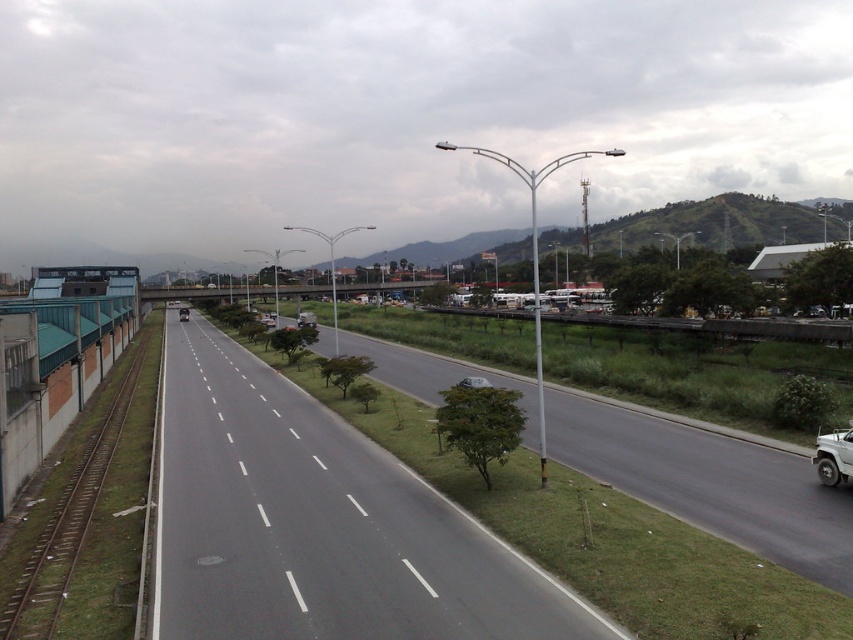
You are standing at the origin point of the image coordinate system. You want to walk to the asphalt road at center. In which direction should you move? Please answer with a direction like north, south, east, west, northeast, etc.

The asphalt road at center is located at coordinate point (317, 524). Since you are at the origin, you should move towards the northeast direction to reach it.

You are standing at the median strip between the lanes and want to walk to a point that is closer to you. Which point should you head towards, point (265, 602) or point (846, 438)?

You should head towards point (265, 602) because it is closer to the viewer than point (846, 438).

You are a delivery driver who needs to cross the road to reach the warehouse on the right. The road has a median strip with grass and trees. Considering the brown metal train track at left and the white matte truck at lower right, which object is closer to your current position?

The brown metal train track at left is closer to your current position because it is positioned on the left side of the image, while the white matte truck at lower right is located further away on the right side.